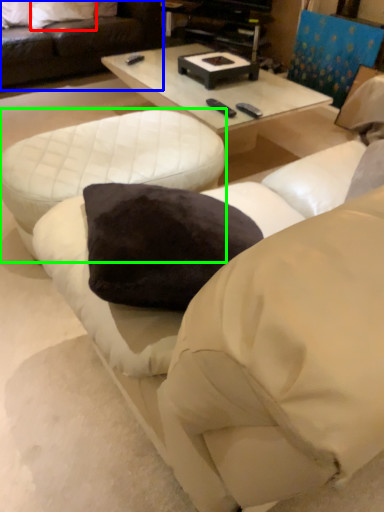
Question: Which object is positioned farthest from pillow (highlighted by a red box)? Select from studio couch (highlighted by a blue box) and table (highlighted by a green box).

Choices:
 (A) studio couch
 (B) table

Answer: (B)